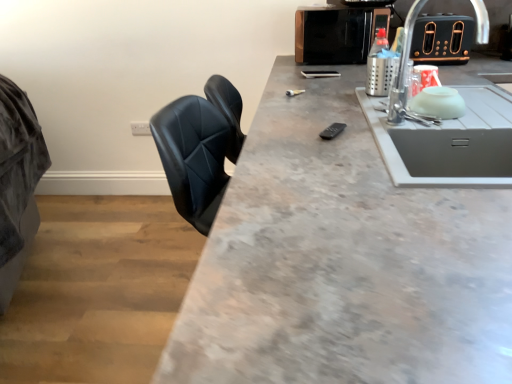
Question: Is metallic microwave at upper right, which appears as the 2th appliance when viewed from the right, positioned beyond the bounds of gray concrete countertop at center?

Choices:
 (A) yes
 (B) no

Answer: (A)

Question: Is the depth of metallic microwave at upper right, which appears as the 2th appliance when viewed from the right, less than that of gray concrete countertop at center?

Choices:
 (A) yes
 (B) no

Answer: (B)

Question: From the image's perspective, is metallic microwave at upper right, which appears as the 2th appliance when viewed from the right, on gray concrete countertop at center?

Choices:
 (A) yes
 (B) no

Answer: (A)

Question: Is metallic microwave at upper right, the 1th appliance when ordered from left to right, smaller than gray concrete countertop at center?

Choices:
 (A) no
 (B) yes

Answer: (B)

Question: From a real-world perspective, is metallic microwave at upper right, which appears as the 2th appliance when viewed from the right, positioned under gray concrete countertop at center based on gravity?

Choices:
 (A) no
 (B) yes

Answer: (A)

Question: Can gray concrete countertop at center be found inside metallic microwave at upper right, the 1th appliance when ordered from left to right?

Choices:
 (A) yes
 (B) no

Answer: (B)

Question: Can you confirm if metallic microwave at upper right, the 1th appliance when ordered from left to right, is thinner than black metallic toaster at upper right, which ranks as the 1th appliance in right-to-left order?

Choices:
 (A) no
 (B) yes

Answer: (B)

Question: Considering the relative sizes of metallic microwave at upper right, the 1th appliance when ordered from left to right, and black metallic toaster at upper right, which ranks as the 1th appliance in right-to-left order, in the image provided, is metallic microwave at upper right, the 1th appliance when ordered from left to right, shorter than black metallic toaster at upper right, which ranks as the 1th appliance in right-to-left order,?

Choices:
 (A) yes
 (B) no

Answer: (B)

Question: Considering the relative sizes of metallic microwave at upper right, which appears as the 2th appliance when viewed from the right, and black metallic toaster at upper right, the second appliance in the left-to-right sequence, in the image provided, is metallic microwave at upper right, which appears as the 2th appliance when viewed from the right, wider than black metallic toaster at upper right, the second appliance in the left-to-right sequence,?

Choices:
 (A) yes
 (B) no

Answer: (B)

Question: Would you say black metallic toaster at upper right, which ranks as the 1th appliance in right-to-left order, is part of metallic microwave at upper right, which appears as the 2th appliance when viewed from the right,'s contents?

Choices:
 (A) yes
 (B) no

Answer: (B)

Question: Is metallic microwave at upper right, which appears as the 2th appliance when viewed from the right, positioned beyond the bounds of black metallic toaster at upper right, the second appliance in the left-to-right sequence?

Choices:
 (A) no
 (B) yes

Answer: (B)

Question: Considering the relative sizes of metallic microwave at upper right, which appears as the 2th appliance when viewed from the right, and black metallic toaster at upper right, which ranks as the 1th appliance in right-to-left order, in the image provided, is metallic microwave at upper right, which appears as the 2th appliance when viewed from the right, bigger than black metallic toaster at upper right, which ranks as the 1th appliance in right-to-left order,?

Choices:
 (A) no
 (B) yes

Answer: (B)

Question: Is gray concrete countertop at center bigger than black metallic toaster at upper right, which ranks as the 1th appliance in right-to-left order?

Choices:
 (A) no
 (B) yes

Answer: (B)